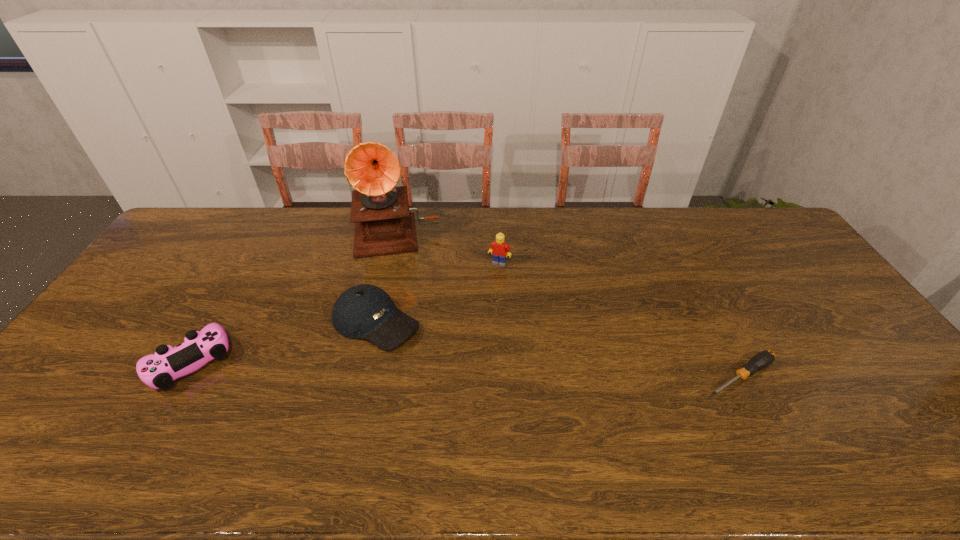
Locate an element on the screen. control at the near edge is located at coordinates (159, 370).

Where is `screwdriver that is positioned at the near edge`? screwdriver that is positioned at the near edge is located at coordinates 761,360.

In the image, there is a desktop. Where is `vacant space at the far edge`? This screenshot has height=540, width=960. vacant space at the far edge is located at coordinates (347, 227).

In the image, there is a desktop. At what (x,y) coordinates should I click in order to perform the action: click on free region at the near edge. Please return your answer as a coordinate pair (x, y). The height and width of the screenshot is (540, 960). Looking at the image, I should click on (340, 425).

In order to click on vacant space at the right edge of the desktop in this screenshot , I will do `click(791, 249)`.

This screenshot has width=960, height=540. In order to click on vacant region at the far right corner in this screenshot , I will do `click(769, 245)`.

Where is `free space between the fourth object from left to right and the baseball cap`? The width and height of the screenshot is (960, 540). free space between the fourth object from left to right and the baseball cap is located at coordinates (438, 292).

The image size is (960, 540). I want to click on free space between the shortest object and the baseball cap, so click(558, 349).

I want to click on free space between the control and the farthest object, so click(293, 298).

This screenshot has width=960, height=540. Identify the location of free space between the farthest object and the fourth nearest object. (447, 248).